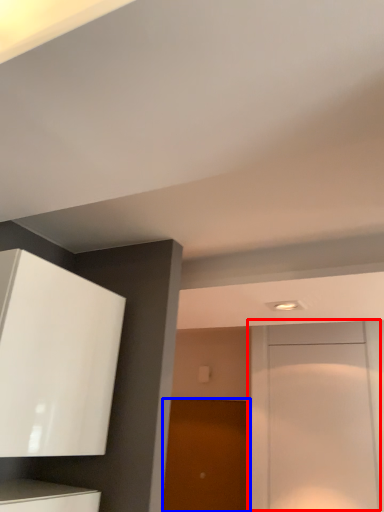
Question: Among these objects, which one is farthest to the camera, door (highlighted by a red box) or door (highlighted by a blue box)?

Choices:
 (A) door
 (B) door

Answer: (B)